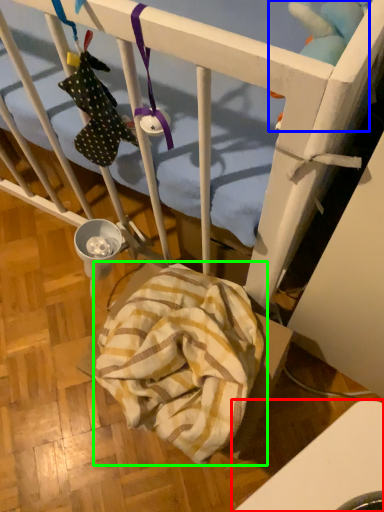
Question: Considering the real-world distances, which object is closest to furniture (highlighted by a red box)? toy (highlighted by a blue box) or blanket (highlighted by a green box).

Choices:
 (A) toy
 (B) blanket

Answer: (B)